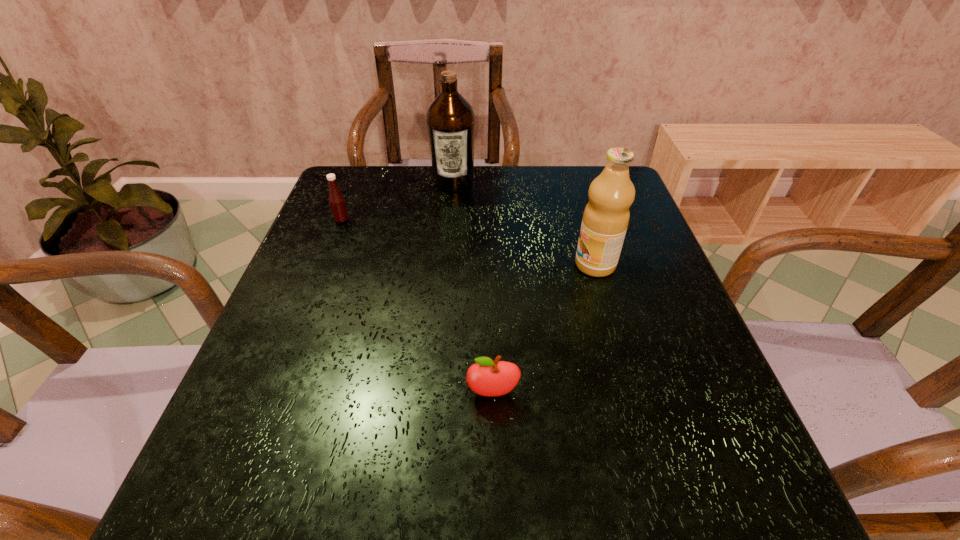
At what (x,y) coordinates should I click in order to perform the action: click on free space at the right edge. Please return your answer as a coordinate pair (x, y). Looking at the image, I should click on (623, 271).

Where is `free space at the far left corner of the desktop`? The height and width of the screenshot is (540, 960). free space at the far left corner of the desktop is located at coordinates (346, 174).

This screenshot has height=540, width=960. In the image, there is a desktop. What are the coordinates of `blank space at the near left corner` in the screenshot? It's located at (224, 524).

Where is `vacant space at the far right corner of the desktop`? This screenshot has width=960, height=540. vacant space at the far right corner of the desktop is located at coordinates (635, 201).

Identify the location of vacant space in between the apple and the farthest object. Image resolution: width=960 pixels, height=540 pixels. (473, 288).

Find the location of a particular element. free space between the third farthest object and the nearest object is located at coordinates (544, 329).

Find the location of a particular element. Image resolution: width=960 pixels, height=540 pixels. unoccupied position between the shortest object and the Tabasco sauce is located at coordinates (418, 307).

Identify the location of free space between the Tabasco sauce and the left olive oil. The height and width of the screenshot is (540, 960). (397, 201).

Locate an element on the screen. This screenshot has height=540, width=960. vacant space in between the second shortest object and the shortest object is located at coordinates (418, 307).

Find the location of `free area in between the apple and the left olive oil`. free area in between the apple and the left olive oil is located at coordinates (473, 288).